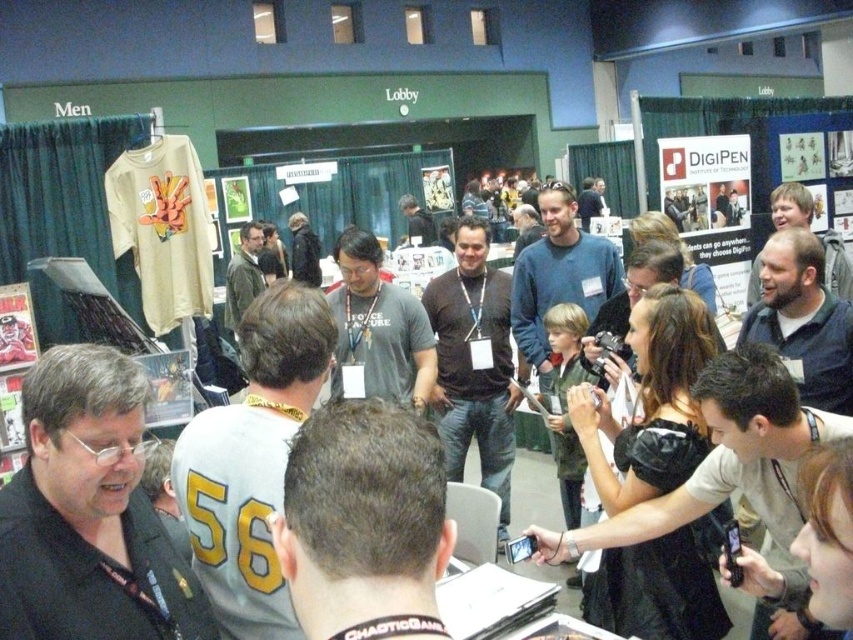
Question: Which is farther from the dark brown hair at center?

Choices:
 (A) matte gray shirt at center
 (B) gray-green jacket at center
 (C) dark blue shirt at center

Answer: (B)

Question: Estimate the real-world distances between objects in this image. Which object is farther from the gray jersey at center?

Choices:
 (A) matte gray shirt at center
 (B) dark blue shirt at center

Answer: (A)

Question: Does dark brown leather jacket at center have a lesser width compared to gray-green jacket at center?

Choices:
 (A) no
 (B) yes

Answer: (A)

Question: Can you confirm if matte black jacket at left is smaller than dark blue shirt at center?

Choices:
 (A) yes
 (B) no

Answer: (A)

Question: Can you confirm if gray-green jacket at center is positioned below dark gray shirt at center?

Choices:
 (A) yes
 (B) no

Answer: (A)

Question: Which object is positioned farthest from the matte black jacket at left?

Choices:
 (A) gray cotton t-shirt at center
 (B) dark brown hair at center
 (C) dark gray shirt at center

Answer: (C)